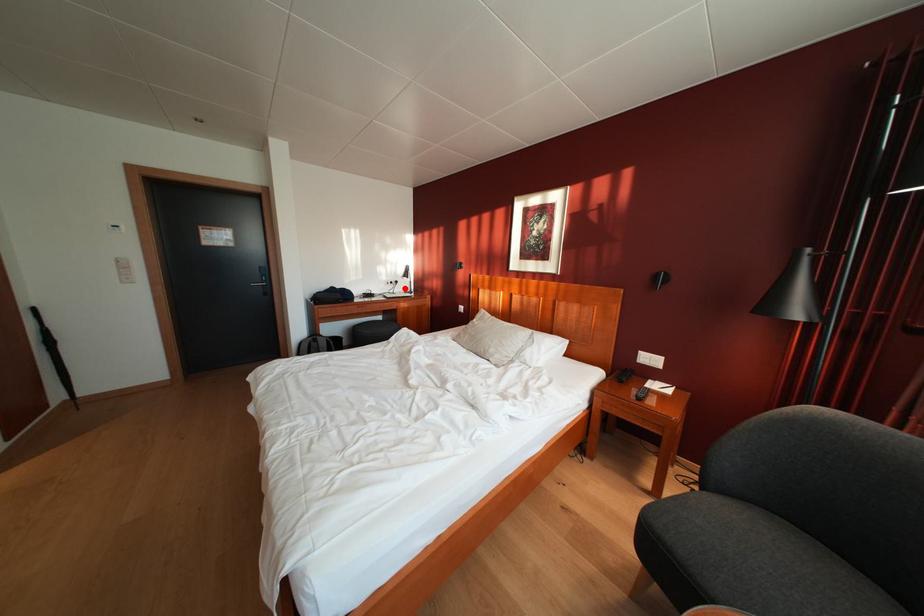
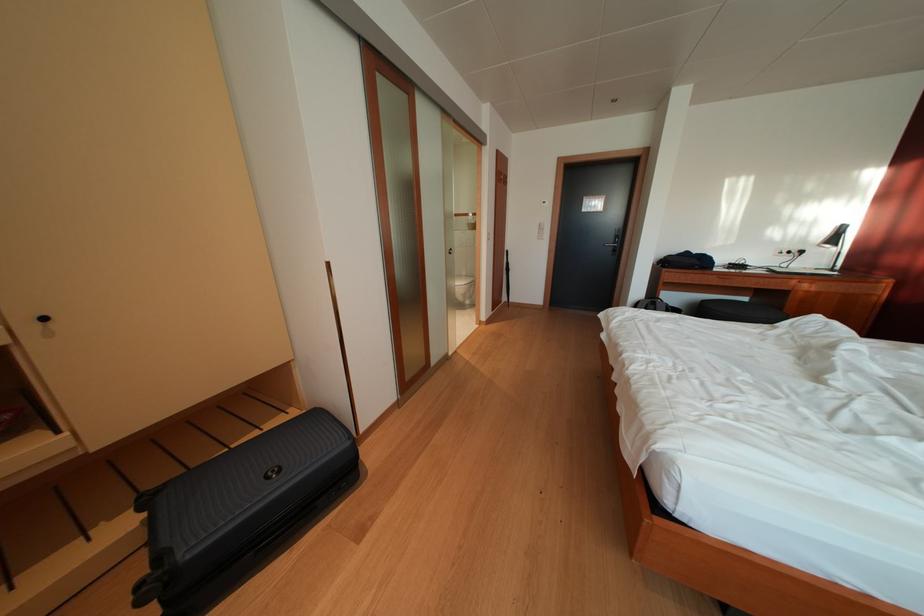
In the second image, find the point that corresponds to the highlighted location in the first image.

(809, 257)